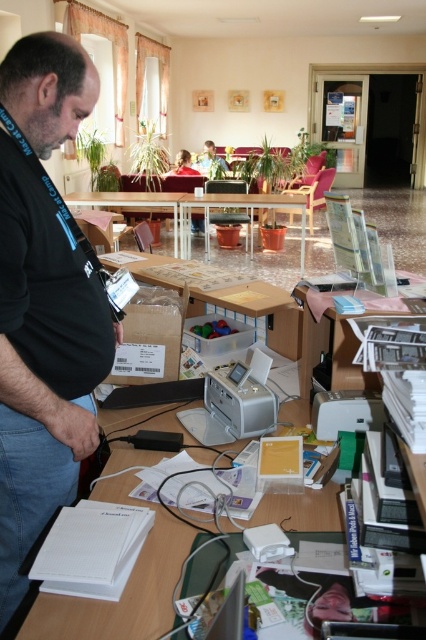
Question: Does silver/plastic printer at center have a smaller size compared to white plastic table at center?

Choices:
 (A) no
 (B) yes

Answer: (B)

Question: Does white plastic table at center have a lesser width compared to metallic silver table at center?

Choices:
 (A) no
 (B) yes

Answer: (B)

Question: Which of the following is the farthest from the observer?

Choices:
 (A) white plastic printer at center
 (B) clear glass table at center
 (C) white plastic table at center
 (D) wooden table at center

Answer: (B)

Question: Which object is farther from the camera taking this photo?

Choices:
 (A) white plastic printer at center
 (B) wooden table at center

Answer: (B)

Question: Is clear glass table at center further to the viewer compared to matte black shirt at center?

Choices:
 (A) no
 (B) yes

Answer: (A)

Question: Which object is farther from the camera taking this photo?

Choices:
 (A) metallic silver table at center
 (B) black matte shirt at center
 (C) wooden table at center
 (D) white plastic table at center

Answer: (A)